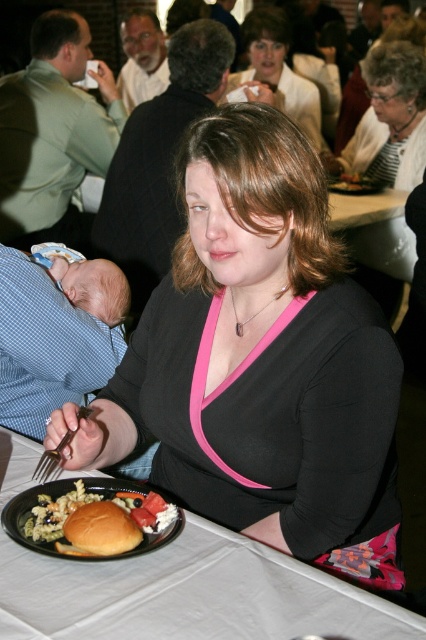
Can you confirm if brown bread at lower left is thinner than matte plastic fork at upper center?

No, brown bread at lower left is not thinner than matte plastic fork at upper center.

Does brown bread at lower left appear under matte plastic fork at upper center?

Correct, brown bread at lower left is located below matte plastic fork at upper center.

Measure the distance between point (134, 481) and camera.

A distance of 1.48 meters exists between point (134, 481) and camera.

This screenshot has width=426, height=640. I want to click on brown bread at lower left, so click(69, 506).

Can you confirm if black matte shirt at center is thinner than golden bread roll at plate center?

In fact, black matte shirt at center might be wider than golden bread roll at plate center.

Is point (204, 330) positioned before point (118, 509)?

No, (204, 330) is further to viewer.

Where is `black matte shirt at center`? The image size is (426, 640). black matte shirt at center is located at coordinates (259, 358).

Can you confirm if matte black shirt at center is shorter than silver metallic fork at lower left?

Incorrect, matte black shirt at center's height does not fall short of silver metallic fork at lower left's.

Between point (244, 22) and point (55, 449), which one is positioned in front?

Point (55, 449)

Is point (290, 90) closer to viewer compared to point (68, 435)?

That is False.

You are a GUI agent. You are given a task and a screenshot of the screen. Output one action in this format:
    pyautogui.click(x=<x>, y=<y>)
    Task: Click on the matte black shirt at center
    Image resolution: width=426 pixels, height=640 pixels.
    Given the screenshot: What is the action you would take?
    coord(279,70)